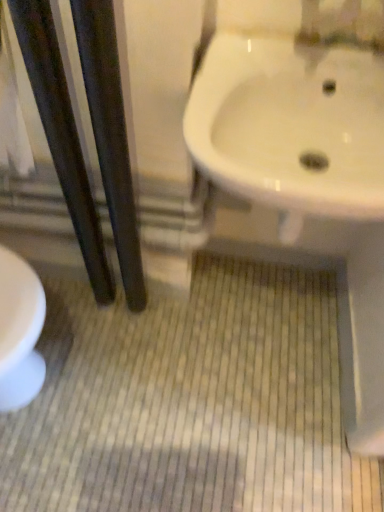
Question: Considering the relative sizes of dark wood pole at left, marked as the first pole in a left-to-right arrangement, and white glossy sink at upper right in the image provided, is dark wood pole at left, marked as the first pole in a left-to-right arrangement, taller than white glossy sink at upper right?

Choices:
 (A) yes
 (B) no

Answer: (A)

Question: Considering the relative sizes of dark wood pole at left, marked as the first pole in a left-to-right arrangement, and white glossy sink at upper right in the image provided, is dark wood pole at left, marked as the first pole in a left-to-right arrangement, thinner than white glossy sink at upper right?

Choices:
 (A) yes
 (B) no

Answer: (A)

Question: Is dark wood pole at left, acting as the second pole starting from the right, wider than white glossy sink at upper right?

Choices:
 (A) yes
 (B) no

Answer: (B)

Question: From a real-world perspective, is dark wood pole at left, marked as the first pole in a left-to-right arrangement, below white glossy sink at upper right?

Choices:
 (A) no
 (B) yes

Answer: (B)

Question: Is dark wood pole at left, acting as the second pole starting from the right, further to the viewer compared to white glossy sink at upper right?

Choices:
 (A) no
 (B) yes

Answer: (A)

Question: From a real-world perspective, is black glossy poles at left, the 1th pole viewed from the right, physically located above or below white glossy sink at upper right?

Choices:
 (A) above
 (B) below

Answer: (B)

Question: In terms of size, does black glossy poles at left, which appears as the second pole when viewed from the left, appear bigger or smaller than white glossy sink at upper right?

Choices:
 (A) small
 (B) big

Answer: (A)

Question: Looking at their shapes, would you say black glossy poles at left, the 1th pole viewed from the right, is wider or thinner than white glossy sink at upper right?

Choices:
 (A) wide
 (B) thin

Answer: (B)

Question: Is black glossy poles at left, the 1th pole viewed from the right, in front of or behind white glossy sink at upper right in the image?

Choices:
 (A) behind
 (B) front

Answer: (B)

Question: Is dark wood pole at left, acting as the second pole starting from the right, bigger or smaller than black glossy poles at left, which appears as the second pole when viewed from the left?

Choices:
 (A) small
 (B) big

Answer: (A)

Question: From a real-world perspective, relative to black glossy poles at left, which appears as the second pole when viewed from the left, is dark wood pole at left, acting as the second pole starting from the right, vertically above or below?

Choices:
 (A) below
 (B) above

Answer: (A)

Question: Would you say dark wood pole at left, acting as the second pole starting from the right, is inside or outside black glossy poles at left, which appears as the second pole when viewed from the left?

Choices:
 (A) outside
 (B) inside

Answer: (A)

Question: From the image's perspective, is dark wood pole at left, marked as the first pole in a left-to-right arrangement, above or below black glossy poles at left, which appears as the second pole when viewed from the left?

Choices:
 (A) above
 (B) below

Answer: (A)

Question: Looking at the image, does dark wood pole at left, marked as the first pole in a left-to-right arrangement, seem bigger or smaller compared to white glossy sink at upper right?

Choices:
 (A) big
 (B) small

Answer: (B)

Question: Is point (91, 217) positioned closer to the camera than point (283, 89)?

Choices:
 (A) closer
 (B) farther

Answer: (B)